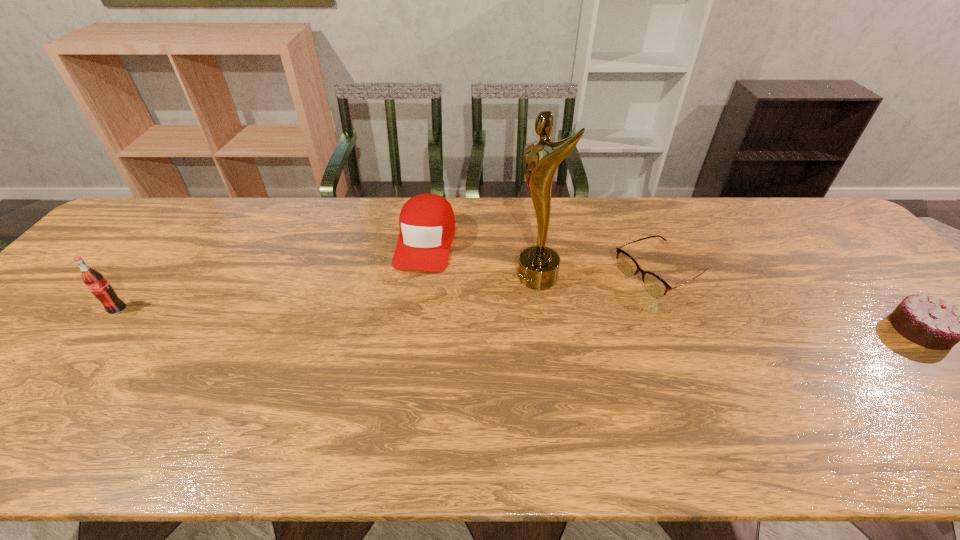
Identify the location of free space on the desktop that is between the soda bottle and the rightmost object and is positioned on the front-facing side of the fourth object from right to left. The height and width of the screenshot is (540, 960). (404, 316).

The image size is (960, 540). I want to click on free space on the desktop that is between the soda bottle and the second shortest object and is positioned on the face of the shortest object, so click(568, 321).

Image resolution: width=960 pixels, height=540 pixels. Identify the location of vacant spot on the desktop that is between the leftmost object and the chocolate cake and is positioned on the front-facing side of the award. (448, 318).